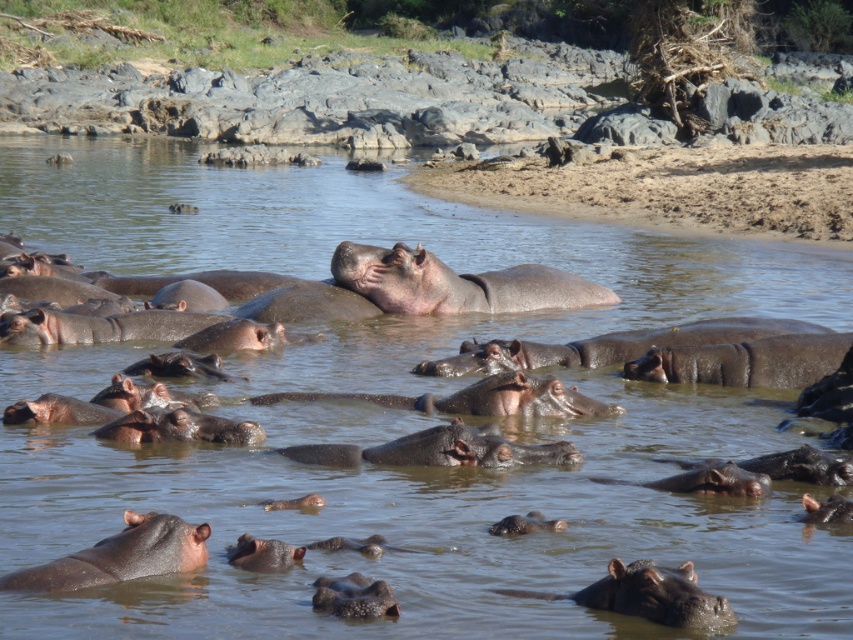
You are a wildlife photographer observing the hippos from a boat in the water. You notice the gray textured hippo at center and the dark brown skin at center. Which object is closer to the surface of the water?

The gray textured hippo at center is shorter than the dark brown skin at center, so the dark brown skin at center is closer to the surface of the water.